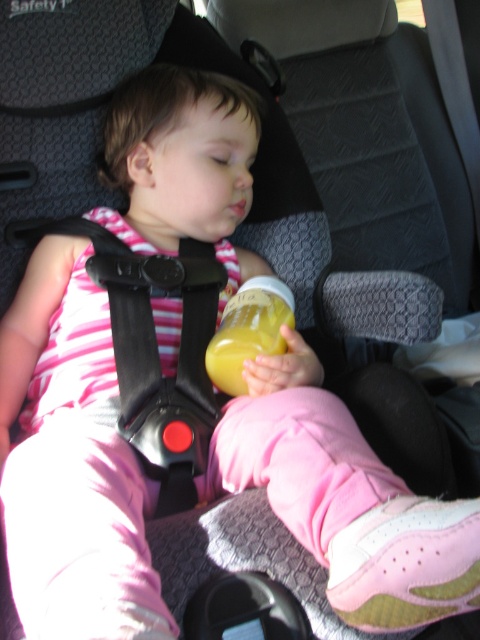
Is black plastic strap at center to the right of yellow matte bottle at center from the viewer's perspective?

Incorrect, black plastic strap at center is not on the right side of yellow matte bottle at center.

Who is shorter, black plastic strap at center or yellow matte bottle at center?

Standing shorter between the two is yellow matte bottle at center.

Between point (116, 289) and point (230, 353), which one is positioned behind?

The point (116, 289) is behind.

Locate an element on the screen. This screenshot has width=480, height=640. black plastic strap at center is located at coordinates (157, 352).